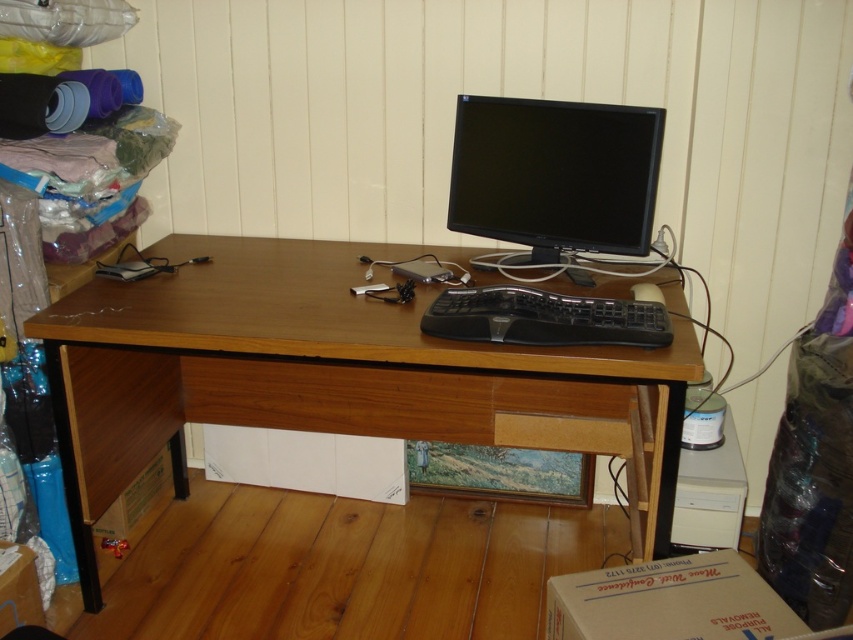
Question: Which point is closer to the camera?

Choices:
 (A) black plastic mouse at center
 (B) white cardboard box at lower right
 (C) cardboard box at lower left

Answer: (B)

Question: Does brown cardboard box at lower left have a lesser width compared to cardboard box at lower left?

Choices:
 (A) no
 (B) yes

Answer: (A)

Question: Is wooden drawer at center smaller than black plastic keyboard at center?

Choices:
 (A) no
 (B) yes

Answer: (A)

Question: Is wooden computer desk at center to the right of white cardboard box at lower right from the viewer's perspective?

Choices:
 (A) yes
 (B) no

Answer: (B)

Question: Based on their relative distances, which object is nearer to the wooden drawer at center?

Choices:
 (A) black plastic keyboard at center
 (B) black glossy monitor at center
 (C) brown cardboard box at lower left
 (D) wooden computer desk at center

Answer: (D)

Question: Which object is the closest to the black plastic keyboard at center?

Choices:
 (A) black plastic mouse at center
 (B) cardboard box at lower left
 (C) black glossy monitor at center

Answer: (A)